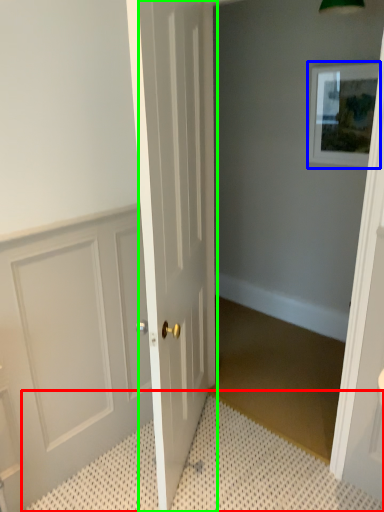
Question: Estimate the real-world distances between objects in this image. Which object is farther from bath mat (highlighted by a red box), picture frame (highlighted by a blue box) or door (highlighted by a green box)?

Choices:
 (A) picture frame
 (B) door

Answer: (A)